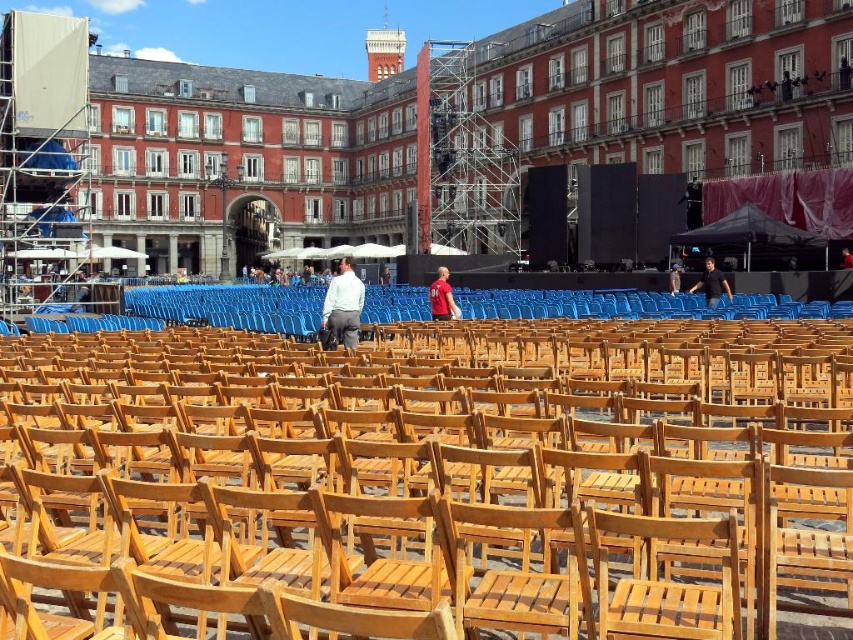
Question: From the image, what is the correct spatial relationship of dark blue shirt at center in relation to brown wooden chair at center?

Choices:
 (A) below
 (B) above

Answer: (A)

Question: Estimate the real-world distances between objects in this image. Which object is farther from the wooden chair at center?

Choices:
 (A) brown wooden chair at center
 (B) light blue shirt at center
 (C) dark blue shirt at center

Answer: (A)

Question: Considering the relative positions of light blue shirt at center and red shirt at center in the image provided, where is light blue shirt at center located with respect to red shirt at center?

Choices:
 (A) above
 (B) below

Answer: (A)

Question: Does wooden chair at center have a larger size compared to light blue shirt at center?

Choices:
 (A) no
 (B) yes

Answer: (B)

Question: Considering the real-world distances, which object is farthest from the brown wooden chair at center?

Choices:
 (A) red shirt at center
 (B) light blue shirt at center

Answer: (B)

Question: Which object is the closest to the light blue shirt at center?

Choices:
 (A) brown wooden chair at center
 (B) dark blue shirt at center
 (C) red shirt at center

Answer: (C)